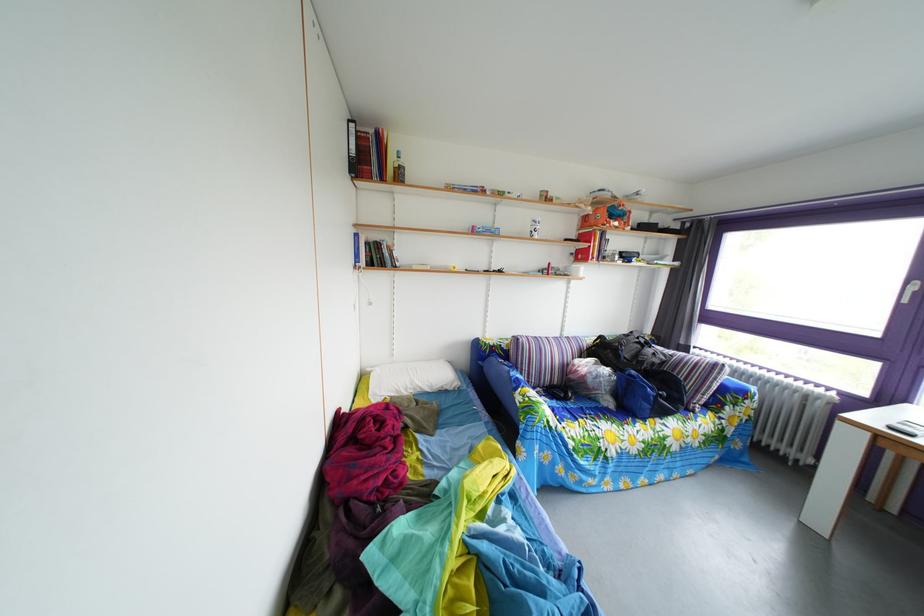
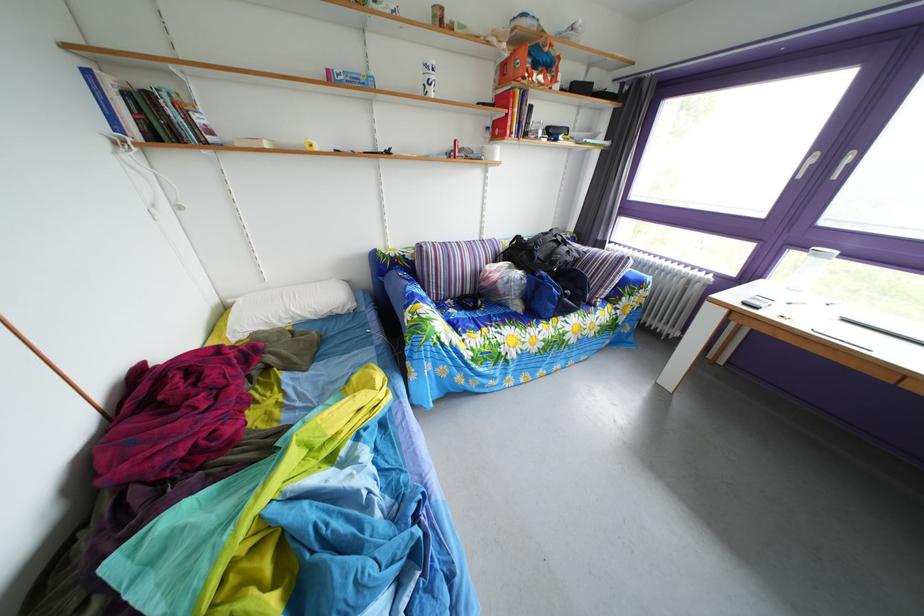
Locate, in the second image, the point that corresponds to pixel 541 232 in the first image.

(432, 79)